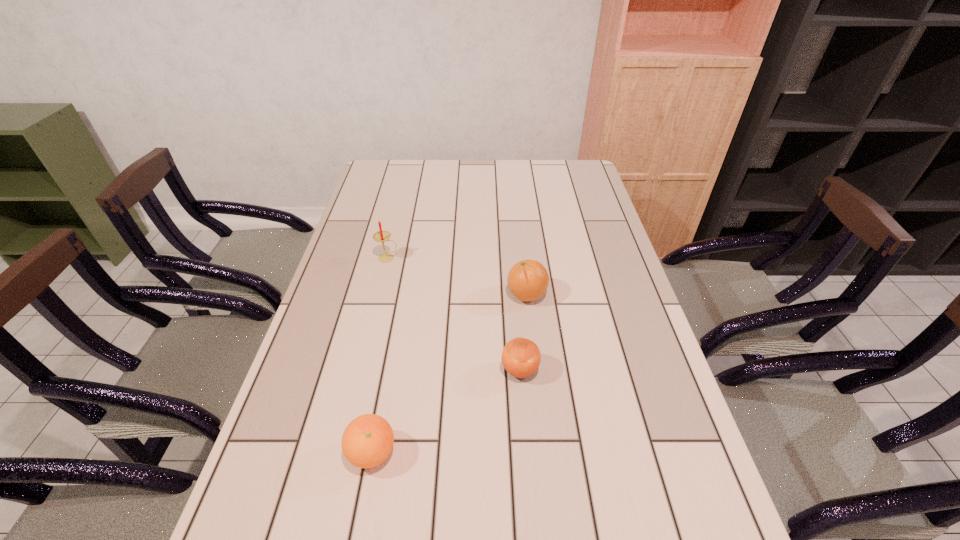
This screenshot has width=960, height=540. In order to click on free space between the candle and the nearest orange in this screenshot , I will do `click(380, 355)`.

You are a GUI agent. You are given a task and a screenshot of the screen. Output one action in this format:
    pyautogui.click(x=<x>, y=<y>)
    Task: Click on the empty space between the tallest object and the leftmost orange
    
    Given the screenshot: What is the action you would take?
    pyautogui.click(x=380, y=355)

This screenshot has width=960, height=540. Find the location of `vacant point located between the leftmost orange and the farthest orange`. vacant point located between the leftmost orange and the farthest orange is located at coordinates (449, 374).

Locate an element on the screen. free point between the candle and the leftmost orange is located at coordinates (380, 355).

Where is `free spot between the second nearest orange and the second farthest object`? This screenshot has width=960, height=540. free spot between the second nearest orange and the second farthest object is located at coordinates (523, 333).

Identify which object is the third nearest to the farthest object. Please provide its 2D coordinates. Your answer should be formatted as a tuple, i.e. [(x, y)], where the tuple contains the x and y coordinates of a point satisfying the conditions above.

[(367, 441)]

Where is `object that is the closest one to the nearest object`? The height and width of the screenshot is (540, 960). object that is the closest one to the nearest object is located at coordinates (521, 357).

Select which orange appears as the second closest to the farthest orange. Please provide its 2D coordinates. Your answer should be formatted as a tuple, i.e. [(x, y)], where the tuple contains the x and y coordinates of a point satisfying the conditions above.

[(367, 441)]

Point out which orange is positioned as the second nearest to the leftmost orange. Please provide its 2D coordinates. Your answer should be formatted as a tuple, i.e. [(x, y)], where the tuple contains the x and y coordinates of a point satisfying the conditions above.

[(528, 280)]

The width and height of the screenshot is (960, 540). I want to click on blank space that satisfies the following two spatial constraints: 1. on the back side of the nearest object; 2. on the left side of the second farthest object, so click(401, 294).